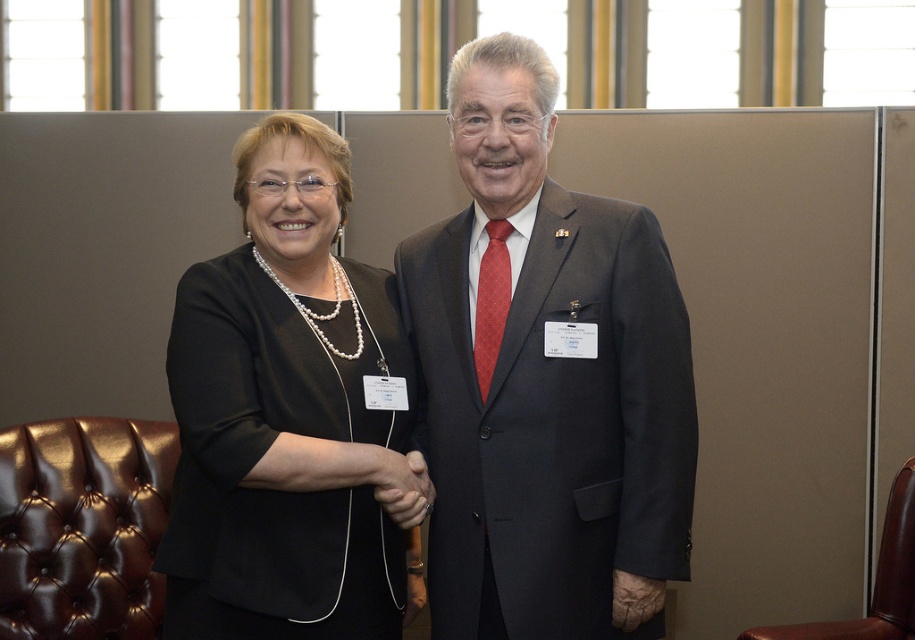
What do you see at coordinates (289, 417) in the screenshot? Image resolution: width=915 pixels, height=640 pixels. I see `black pearl necklace at center` at bounding box center [289, 417].

Between black pearl necklace at center and brown leather armchair at right, which one has less height?

brown leather armchair at right

This screenshot has width=915, height=640. What are the coordinates of `black pearl necklace at center` in the screenshot? It's located at (289, 417).

Who is taller, matte black suit at center or black pearl necklace at center?

matte black suit at center

Describe the element at coordinates (545, 381) in the screenshot. I see `matte black suit at center` at that location.

You are a GUI agent. You are given a task and a screenshot of the screen. Output one action in this format:
    pyautogui.click(x=<x>, y=<y>)
    Task: Click on the matte black suit at center
    
    Given the screenshot: What is the action you would take?
    pyautogui.click(x=545, y=381)

The width and height of the screenshot is (915, 640). Identify the location of matte black suit at center. (545, 381).

Does black pearl necklace at center have a lesser height compared to brown leather armchair at lower left?

Incorrect, black pearl necklace at center's height does not fall short of brown leather armchair at lower left's.

Consider the image. Who is more forward, (384, 374) or (156, 520)?

Point (384, 374)

Where is `black pearl necklace at center`? black pearl necklace at center is located at coordinates (289, 417).